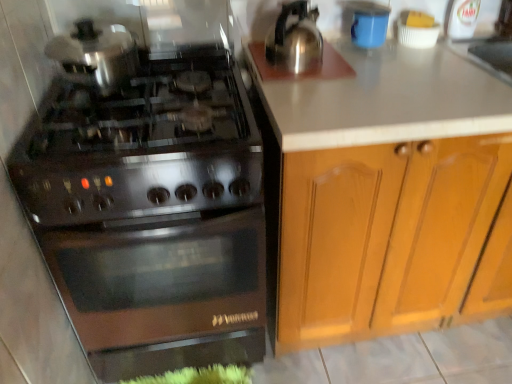
Question: Is wooden cabinet at right wider than stainless steel gas stove at left?

Choices:
 (A) no
 (B) yes

Answer: (A)

Question: From the image's perspective, does wooden cabinet at right appear higher than stainless steel gas stove at left?

Choices:
 (A) yes
 (B) no

Answer: (A)

Question: From a real-world perspective, does wooden cabinet at right stand above stainless steel gas stove at left?

Choices:
 (A) yes
 (B) no

Answer: (B)

Question: Can you confirm if wooden cabinet at right is positioned to the left of stainless steel gas stove at left?

Choices:
 (A) no
 (B) yes

Answer: (A)

Question: Can you confirm if wooden cabinet at right is taller than stainless steel gas stove at left?

Choices:
 (A) yes
 (B) no

Answer: (A)

Question: Looking at their shapes, would you say stainless steel gas stove at left is wider or thinner than wooden cabinet at right?

Choices:
 (A) wide
 (B) thin

Answer: (A)

Question: Relative to wooden cabinet at right, is stainless steel gas stove at left in front or behind?

Choices:
 (A) front
 (B) behind

Answer: (A)

Question: Based on their sizes in the image, would you say stainless steel gas stove at left is bigger or smaller than wooden cabinet at right?

Choices:
 (A) big
 (B) small

Answer: (B)

Question: From the image's perspective, is stainless steel gas stove at left above or below wooden cabinet at right?

Choices:
 (A) below
 (B) above

Answer: (A)

Question: From a real-world perspective, is stainless steel gas stove at left physically located above or below blue matte cup at upper right?

Choices:
 (A) above
 (B) below

Answer: (B)

Question: Would you say stainless steel gas stove at left is to the left or to the right of blue matte cup at upper right in the picture?

Choices:
 (A) right
 (B) left

Answer: (B)

Question: Does point (178, 355) appear closer or farther from the camera than point (373, 3)?

Choices:
 (A) farther
 (B) closer

Answer: (B)

Question: From the image's perspective, relative to blue matte cup at upper right, is stainless steel gas stove at left above or below?

Choices:
 (A) below
 (B) above

Answer: (A)

Question: From a real-world perspective, is blue matte cup at upper right above or below stainless steel gas stove at left?

Choices:
 (A) above
 (B) below

Answer: (A)

Question: Relative to stainless steel gas stove at left, is blue matte cup at upper right in front or behind?

Choices:
 (A) front
 (B) behind

Answer: (B)